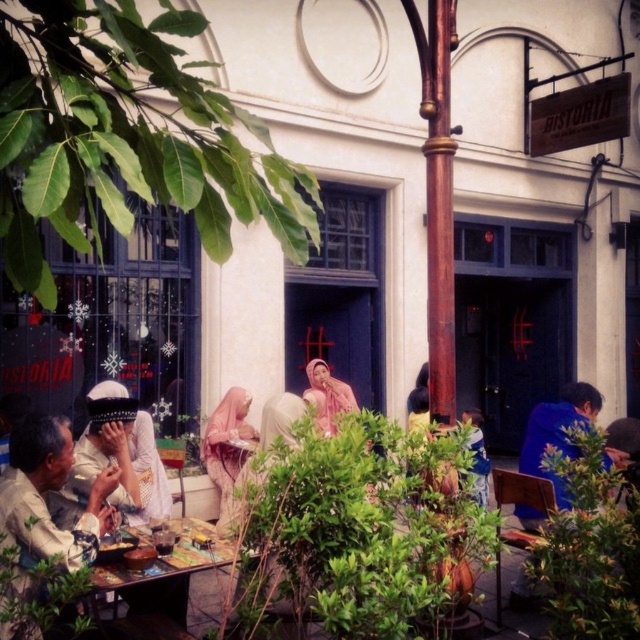
Question: Among these points, which one is farthest from the camera?

Choices:
 (A) (572, 442)
 (B) (179, 580)
 (C) (74, 556)

Answer: (A)

Question: Where is white fabric headscarf at lower left located in relation to pink fabric headscarf at center in the image?

Choices:
 (A) left
 (B) right

Answer: (A)

Question: Can you confirm if white fabric headscarf at lower left is smaller than wooden table at center?

Choices:
 (A) yes
 (B) no

Answer: (A)

Question: Among these points, which one is nearest to the camera?

Choices:
 (A) (186, 552)
 (B) (148, 468)
 (C) (518, 468)

Answer: (A)

Question: Can you confirm if white matte headscarf at left is positioned to the left of blue fabric shirt at right?

Choices:
 (A) no
 (B) yes

Answer: (B)

Question: Which of the following is the farthest from the observer?

Choices:
 (A) (157, 592)
 (B) (232, 490)

Answer: (B)